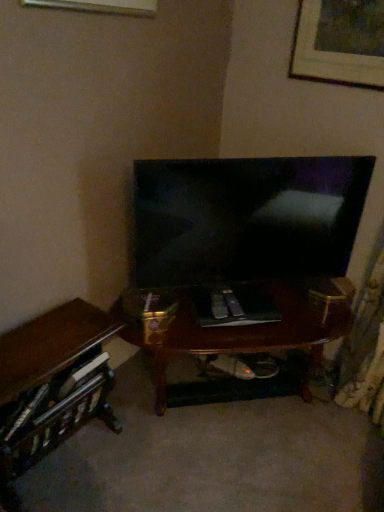
Question: From the image's perspective, is wooden desk at lower left under matte black tv at center?

Choices:
 (A) yes
 (B) no

Answer: (A)

Question: Is wooden desk at lower left closer to camera compared to matte black tv at center?

Choices:
 (A) no
 (B) yes

Answer: (B)

Question: Considering the relative sizes of wooden desk at lower left and matte black tv at center in the image provided, is wooden desk at lower left smaller than matte black tv at center?

Choices:
 (A) no
 (B) yes

Answer: (A)

Question: Are wooden desk at lower left and matte black tv at center far apart?

Choices:
 (A) yes
 (B) no

Answer: (B)

Question: Considering the relative sizes of wooden desk at lower left and matte black tv at center in the image provided, is wooden desk at lower left shorter than matte black tv at center?

Choices:
 (A) yes
 (B) no

Answer: (A)

Question: In terms of width, does wooden desk at lower left look wider or thinner when compared to matte black tv at center?

Choices:
 (A) thin
 (B) wide

Answer: (B)

Question: In terms of size, does wooden desk at lower left appear bigger or smaller than matte black tv at center?

Choices:
 (A) big
 (B) small

Answer: (A)

Question: From a real-world perspective, is wooden desk at lower left above or below matte black tv at center?

Choices:
 (A) above
 (B) below

Answer: (B)

Question: Is wooden desk at lower left taller or shorter than matte black tv at center?

Choices:
 (A) short
 (B) tall

Answer: (A)

Question: Considering their positions, is matte black tv at center located in front of or behind wooden picture frame at upper right?

Choices:
 (A) behind
 (B) front

Answer: (B)

Question: From the image's perspective, is matte black tv at center positioned above or below wooden picture frame at upper right?

Choices:
 (A) below
 (B) above

Answer: (A)

Question: In terms of size, does matte black tv at center appear bigger or smaller than wooden picture frame at upper right?

Choices:
 (A) big
 (B) small

Answer: (A)

Question: Choose the correct answer: Is matte black tv at center inside wooden picture frame at upper right or outside it?

Choices:
 (A) outside
 (B) inside

Answer: (A)

Question: From a real-world perspective, is wooden picture frame at upper right physically located above or below wooden desk at lower left?

Choices:
 (A) below
 (B) above

Answer: (B)

Question: From the image's perspective, is wooden picture frame at upper right positioned above or below wooden desk at lower left?

Choices:
 (A) below
 (B) above

Answer: (B)